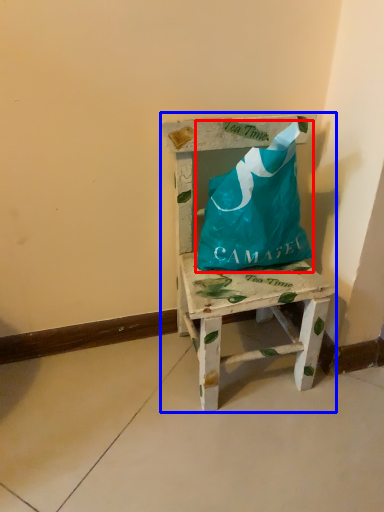
Question: Which of the following is the farthest to the observer, wrap (highlighted by a red box) or furniture (highlighted by a blue box)?

Choices:
 (A) wrap
 (B) furniture

Answer: (A)